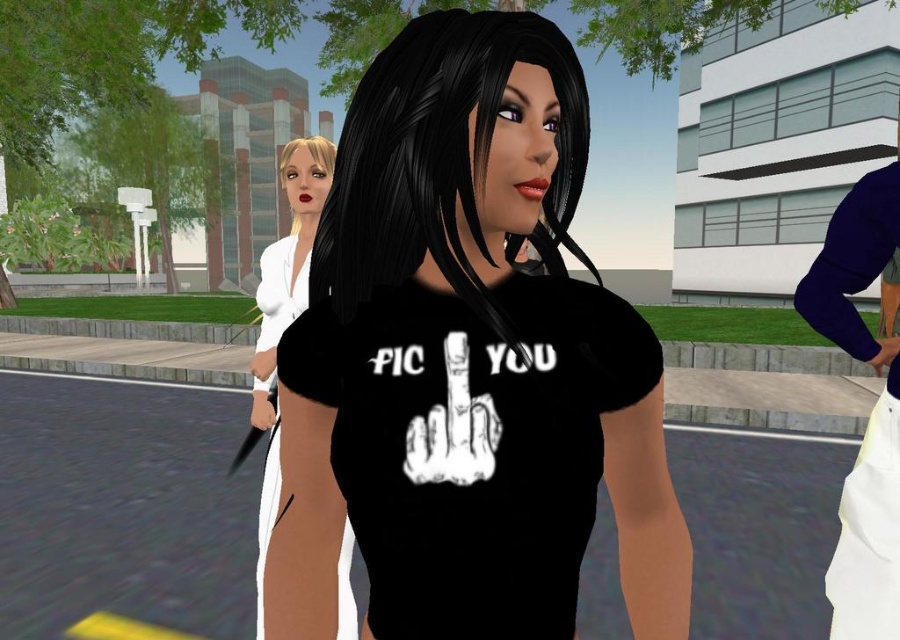
Looking at this image, you are a photographer trying to capture a photo of the black matte t shirt at center. You notice a point at coordinate (468, 362). What does this point indicate?

The point at coordinate (468, 362) indicates the location of the black matte t shirt at center.